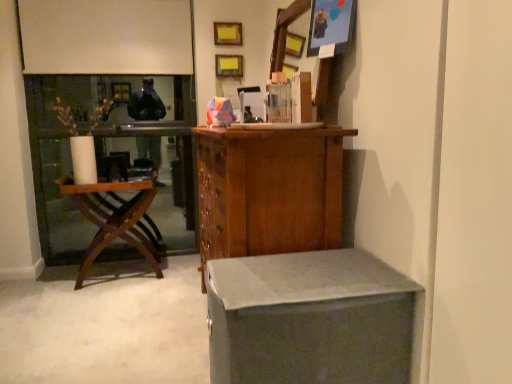
Where is `free space in front of woodenchair at left`? free space in front of woodenchair at left is located at coordinates 81,301.